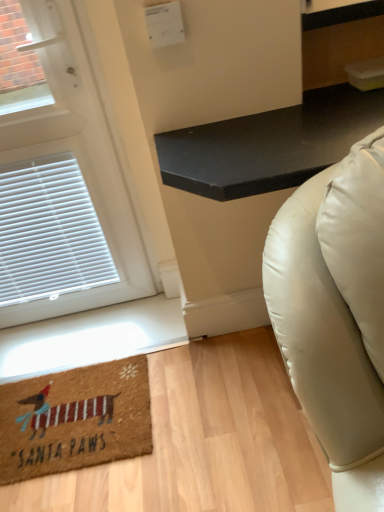
Question: Should I look upward or downward to see white matte door at upper left?

Choices:
 (A) down
 (B) up

Answer: (B)

Question: Can you confirm if brown coir mat at lower left is shorter than black matte table at upper right?

Choices:
 (A) no
 (B) yes

Answer: (B)

Question: Does brown coir mat at lower left have a greater width compared to black matte table at upper right?

Choices:
 (A) no
 (B) yes

Answer: (A)

Question: Is brown coir mat at lower left placed right next to black matte table at upper right?

Choices:
 (A) yes
 (B) no

Answer: (B)

Question: Is brown coir mat at lower left to the left of black matte table at upper right from the viewer's perspective?

Choices:
 (A) yes
 (B) no

Answer: (A)

Question: Does brown coir mat at lower left have a smaller size compared to black matte table at upper right?

Choices:
 (A) yes
 (B) no

Answer: (A)

Question: Does brown coir mat at lower left appear on the right side of black matte table at upper right?

Choices:
 (A) yes
 (B) no

Answer: (B)

Question: From a real-world perspective, is black matte table at upper right physically below brown coir mat at lower left?

Choices:
 (A) no
 (B) yes

Answer: (A)

Question: Does black matte table at upper right have a lesser width compared to brown coir mat at lower left?

Choices:
 (A) yes
 (B) no

Answer: (B)

Question: Is brown coir mat at lower left at the back of black matte table at upper right?

Choices:
 (A) no
 (B) yes

Answer: (A)

Question: From the image's perspective, is black matte table at upper right located above brown coir mat at lower left?

Choices:
 (A) no
 (B) yes

Answer: (B)

Question: Is black matte table at upper right not near brown coir mat at lower left?

Choices:
 (A) yes
 (B) no

Answer: (B)

Question: From the image's perspective, is black matte table at upper right under brown coir mat at lower left?

Choices:
 (A) no
 (B) yes

Answer: (A)

Question: Is black matte table at upper right at the left side of white matte door at upper left?

Choices:
 (A) yes
 (B) no

Answer: (B)